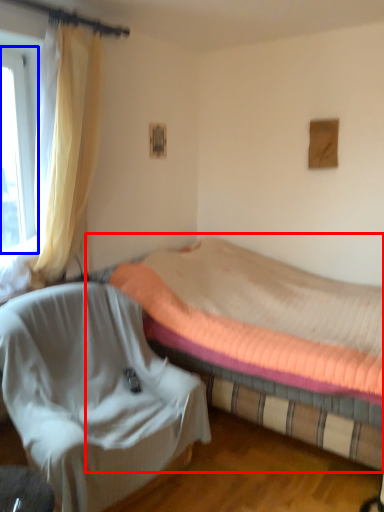
Question: Which object appears farthest to the camera in this image, bed (highlighted by a red box) or window (highlighted by a blue box)?

Choices:
 (A) bed
 (B) window

Answer: (B)